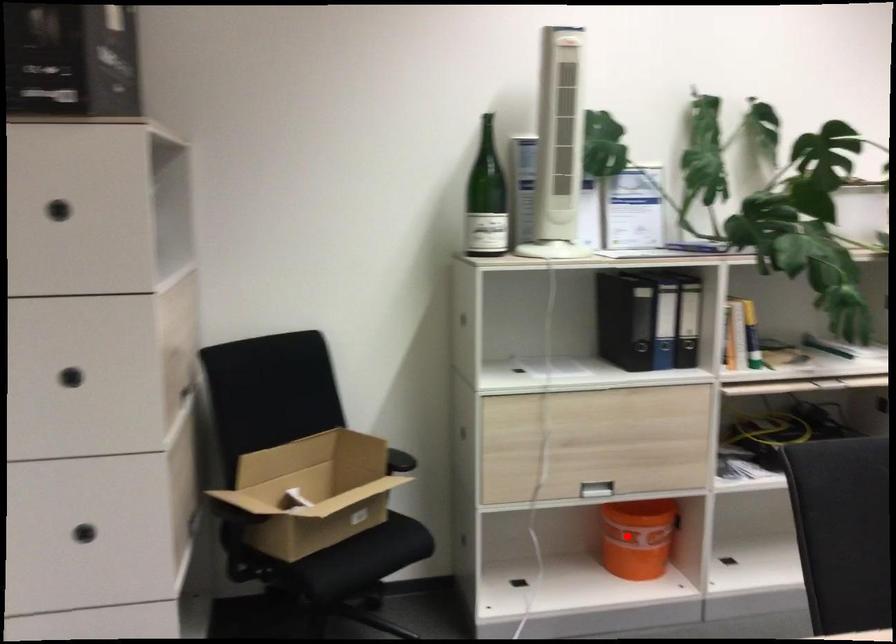
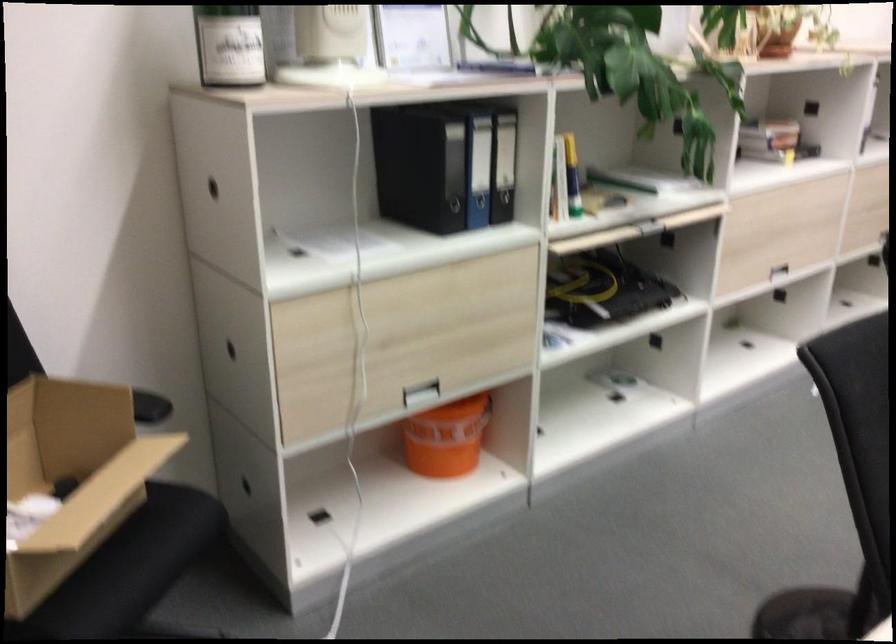
Question: I am providing you with two images of the same scene from different viewpoints. Given a red point in image1, look at the same physical point in image2. Is it:

Choices:
 (A) Closer to the viewpoint
 (B) Farther from the viewpoint

Answer: (A)